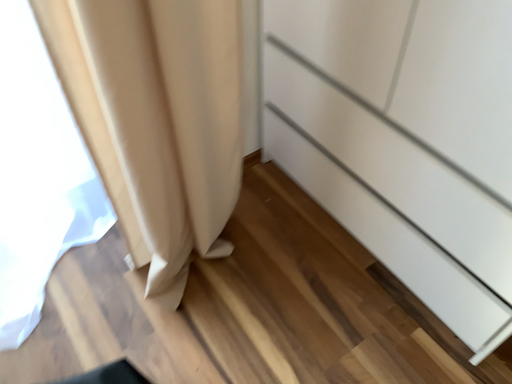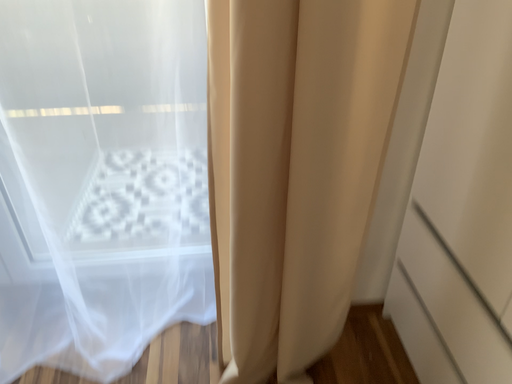
Question: Which way did the camera rotate in the video?

Choices:
 (A) rotated downward
 (B) rotated upward

Answer: (B)